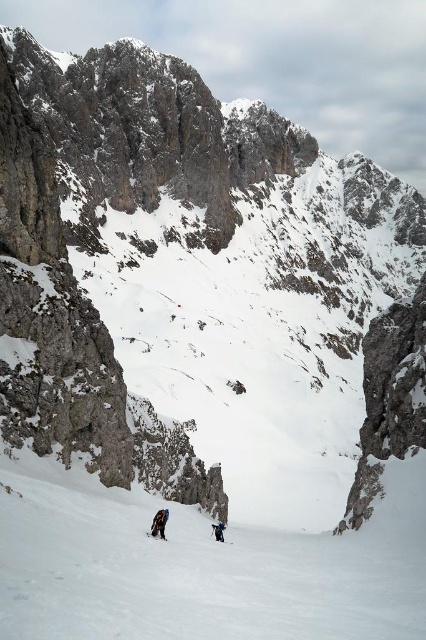
Question: Which object is the farthest from the white snow ski slope at lower center?

Choices:
 (A) blue fabric jacket at center
 (B) matte black ski at lower center

Answer: (A)

Question: Is blue fabric jacket at center positioned before matte black ski at lower center?

Choices:
 (A) no
 (B) yes

Answer: (A)

Question: Which object appears closest to the camera in this image?

Choices:
 (A) white snow ski slope at lower center
 (B) matte black ski at lower center

Answer: (A)

Question: Does dark gray fabric jacket at center have a lesser width compared to blue fabric jacket at center?

Choices:
 (A) no
 (B) yes

Answer: (A)

Question: Which point is farther to the camera?

Choices:
 (A) (152, 536)
 (B) (157, 524)
 (C) (5, 636)

Answer: (B)

Question: Does blue fabric jacket at center have a smaller size compared to matte black ski at lower center?

Choices:
 (A) no
 (B) yes

Answer: (A)